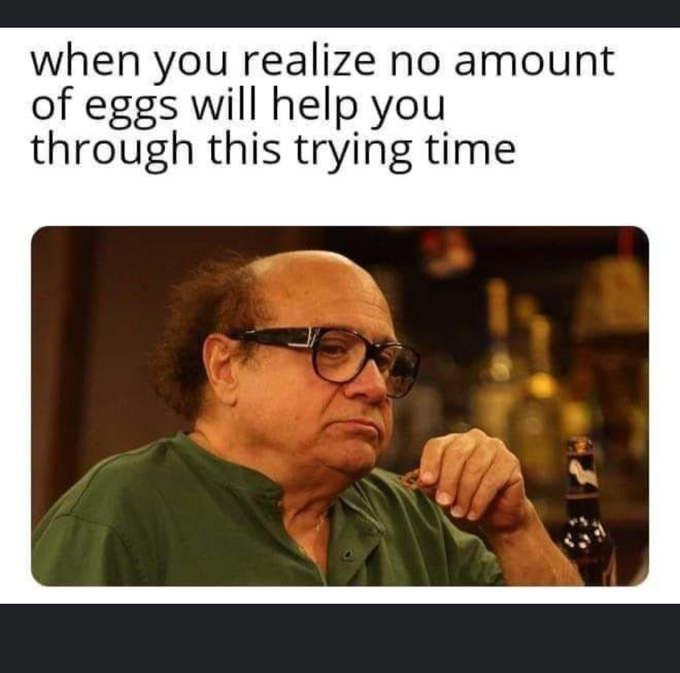
The image size is (680, 673). Identify the location of bottles in the background. (543, 409), (493, 404), (544, 363).